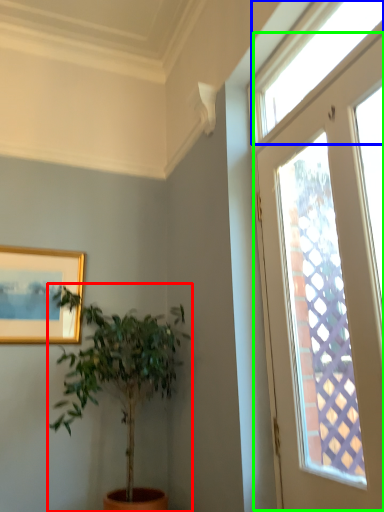
Question: Estimate the real-world distances between objects in this image. Which object is farther from houseplant (highlighted by a red box), window (highlighted by a blue box) or window (highlighted by a green box)?

Choices:
 (A) window
 (B) window

Answer: (A)